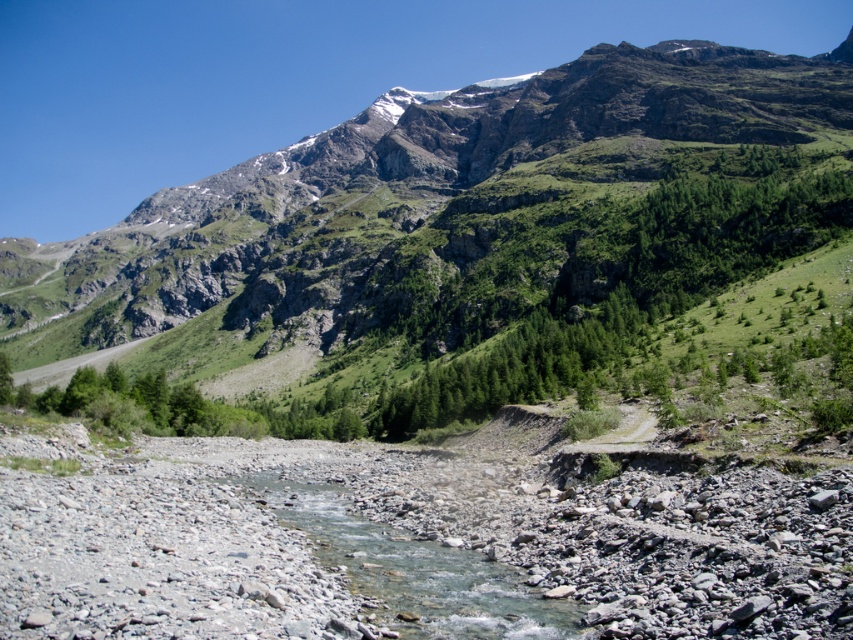
You are planning to cross the clear water at center to reach the green rocky mountain at upper center. Considering the width of the water and the mountain, which one is wider?

The green rocky mountain at upper center might be wider than clear water at center according to the description.